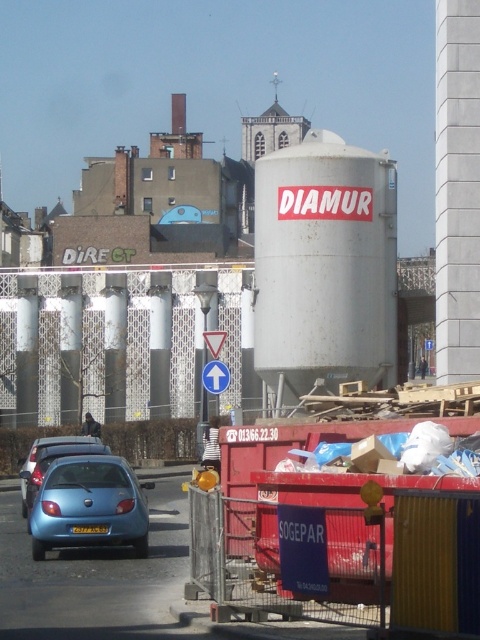
Question: Among these objects, which one is farthest from the camera?

Choices:
 (A) rusty metal water tower at center
 (B) white plastic traffic sign at center
 (C) matte blue hatchback at lower left

Answer: (A)

Question: Does rusty metal water tower at center appear under white plastic traffic sign at center?

Choices:
 (A) yes
 (B) no

Answer: (B)

Question: Does matte blue car at lower left have a smaller size compared to matte blue hatchback at lower left?

Choices:
 (A) no
 (B) yes

Answer: (A)

Question: Which object is farther from the camera taking this photo?

Choices:
 (A) rusty metal water tower at center
 (B) matte blue car at lower left
 (C) white plastic traffic sign at center
 (D) matte blue hatchback at lower left

Answer: (A)

Question: Does rusty metal water tower at center lie behind white plastic traffic sign at center?

Choices:
 (A) yes
 (B) no

Answer: (A)

Question: Which point is farther to the camera?

Choices:
 (A) matte blue hatchback at lower left
 (B) white plastic traffic sign at center

Answer: (B)